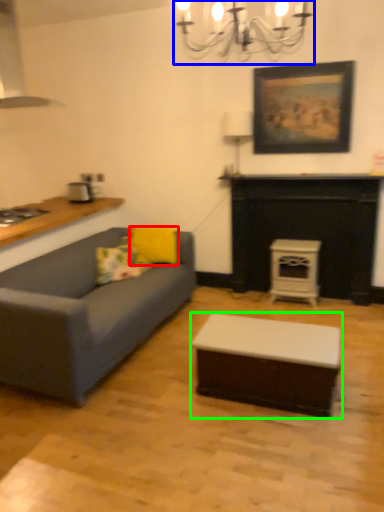
Question: Which object is the farthest from pillow (highlighted by a red box)? Choose among these: light fixture (highlighted by a blue box) or coffee table (highlighted by a green box).

Choices:
 (A) light fixture
 (B) coffee table

Answer: (A)